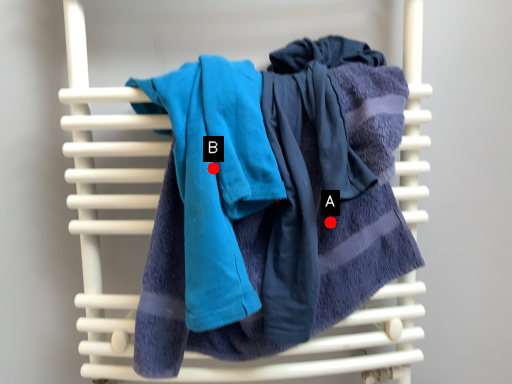
Question: Two points are circled on the image, labeled by A and B beside each circle. Which point appears closest to the camera in this image?

Choices:
 (A) A is closer
 (B) B is closer

Answer: (B)